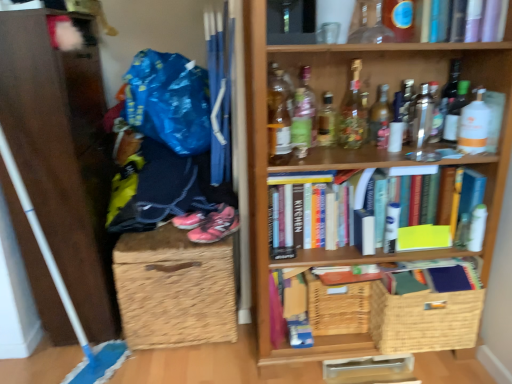
At what (x,y) coordinates should I click in order to perform the action: click on woven straw basket at lower center. Please return your answer as a coordinate pair (x, y). Looking at the image, I should click on (174, 289).

This screenshot has width=512, height=384. What do you see at coordinates (174, 289) in the screenshot?
I see `woven straw basket at lower center` at bounding box center [174, 289].

What do you see at coordinates (62, 154) in the screenshot? Image resolution: width=512 pixels, height=384 pixels. I see `brown wicker basket at lower left` at bounding box center [62, 154].

Where is `woven brown basket at lower right, the first basket from the right`? The width and height of the screenshot is (512, 384). woven brown basket at lower right, the first basket from the right is located at coordinates (424, 320).

From the picture: Considering the relative sizes of translucent glass bottle at center, the eighth bottle positioned from the right, and translucent plastic bottle at upper right, which is the eleventh bottle from left to right, in the image provided, is translucent glass bottle at center, the eighth bottle positioned from the right, thinner than translucent plastic bottle at upper right, which is the eleventh bottle from left to right,?

No, translucent glass bottle at center, the eighth bottle positioned from the right, is not thinner than translucent plastic bottle at upper right, which is the eleventh bottle from left to right.

Based on the photo, between translucent glass bottle at center, which is the fourth bottle from left to right, and translucent plastic bottle at upper right, which is the eleventh bottle from left to right, which one is positioned behind?

translucent glass bottle at center, which is the fourth bottle from left to right, is further away from the camera.

From a real-world perspective, who is located lower, translucent glass bottle at center, the eighth bottle positioned from the right, or translucent plastic bottle at upper right, which is the eleventh bottle from left to right?

From a 3D spatial view, translucent glass bottle at center, the eighth bottle positioned from the right, is below.

Is translucent glass bottle at center, which is the fourth bottle from left to right, inside or outside of translucent plastic bottle at upper right, positioned as the 1th bottle in right-to-left order?

translucent glass bottle at center, which is the fourth bottle from left to right, is spatially situated outside translucent plastic bottle at upper right, positioned as the 1th bottle in right-to-left order.

Is translucent glass bottle at upper center, marked as the eleventh bottle in a right-to-left arrangement, looking in the opposite direction of woven brown basket at lower right, the second basket when ordered from left to right?

No.

Can you confirm if translucent glass bottle at upper center, the first bottle from the left, is positioned to the left of woven brown basket at lower right, the second basket when ordered from left to right?

Yes, translucent glass bottle at upper center, the first bottle from the left, is to the left of woven brown basket at lower right, the second basket when ordered from left to right.

Is translucent glass bottle at upper center, the first bottle from the left, in front of or behind woven brown basket at lower right, the first basket from the right, in the image?

translucent glass bottle at upper center, the first bottle from the left, is in front of woven brown basket at lower right, the first basket from the right.

Is translucent glass bottle at upper center, the first bottle from the left, situated inside woven brown basket at lower right, the second basket when ordered from left to right, or outside?

translucent glass bottle at upper center, the first bottle from the left, is outside woven brown basket at lower right, the second basket when ordered from left to right.

Is woven straw basket at lower center not inside green glass bottle at upper center, the second bottle from the left?

Absolutely, woven straw basket at lower center is external to green glass bottle at upper center, the second bottle from the left.

Can you confirm if woven straw basket at lower center is bigger than green glass bottle at upper center, the second bottle from the left?

Correct, woven straw basket at lower center is larger in size than green glass bottle at upper center, the second bottle from the left.

Which object is positioned more to the left, woven straw basket at lower center or green glass bottle at upper center, the second bottle from the left?

A: woven straw basket at lower center.

Is green glass bottle at upper center, the 10th bottle from the right, at the back of woven straw basket at lower center?

No, woven straw basket at lower center is not facing the opposite direction of green glass bottle at upper center, the 10th bottle from the right.

Based on the photo, could wooden bookcase at upper right be considered to be inside woven straw basket at lower center?

No, wooden bookcase at upper right is not surrounded by woven straw basket at lower center.

Is woven straw basket at lower center facing away from wooden bookcase at upper right?

No, woven straw basket at lower center's orientation is not away from wooden bookcase at upper right.

I want to click on storage box directly beneath the wooden bookcase at upper right (from a real-world perspective), so click(174, 289).

Considering the relative sizes of green glass bottle at upper center, acting as the third bottle starting from the left, and translucent plastic bottle at upper right, which is the eleventh bottle from left to right, in the image provided, is green glass bottle at upper center, acting as the third bottle starting from the left, thinner than translucent plastic bottle at upper right, which is the eleventh bottle from left to right,?

Yes.

This screenshot has width=512, height=384. I want to click on bottle that is the 6th one when counting backward from the translucent plastic bottle at upper right, positioned as the 1th bottle in right-to-left order, so click(306, 103).

From the image's perspective, is green glass bottle at upper center, acting as the third bottle starting from the left, over translucent plastic bottle at upper right, which is the eleventh bottle from left to right?

Yes, from the image's perspective, green glass bottle at upper center, acting as the third bottle starting from the left, is above translucent plastic bottle at upper right, which is the eleventh bottle from left to right.

Would you say green glass bottle at upper center, acting as the third bottle starting from the left, is inside or outside translucent plastic bottle at upper right, positioned as the 1th bottle in right-to-left order?

green glass bottle at upper center, acting as the third bottle starting from the left, is spatially situated outside translucent plastic bottle at upper right, positioned as the 1th bottle in right-to-left order.

From the image's perspective, is wooden bookcase at upper right over translucent glass bottle at upper center, the first bottle from the left?

No.

What are the coordinates of `the 5th bottle counting from the left of the wooden bookcase at upper right` in the screenshot? It's located at (278, 118).

Can you confirm if wooden bookcase at upper right is bigger than translucent glass bottle at upper center, marked as the eleventh bottle in a right-to-left arrangement?

Yes, wooden bookcase at upper right is bigger than translucent glass bottle at upper center, marked as the eleventh bottle in a right-to-left arrangement.

Which point is more distant from viewer, (x=390, y=251) or (x=460, y=82)?

The point (x=390, y=251) is farther.

From the image's perspective, is hardcover books at center, acting as the second book starting from the top, located above clear glass bottle at upper right, which appears as the 10th bottle when viewed from the left?

No, from the image's perspective, hardcover books at center, acting as the second book starting from the top, is not on top of clear glass bottle at upper right, which appears as the 10th bottle when viewed from the left.

I want to click on bottle that is the 4th object above the translucent glass bottle at center, the eighth bottle positioned from the right (from a real-world perspective), so click(474, 125).

Identify the location of the 1st bottle positioned above the woven brown basket at lower right, the first basket from the right (from the image's perspective). This screenshot has height=384, width=512. (278, 118).

Consider the image. From the image, which object appears to be farther from clear glass bottle at upper center, placed as the 3th bottle when sorted from right to left, translucent glass bottle at center, which is the fourth bottle from left to right, or matte yellow notebook at lower right, acting as the third book starting from the top?

Among the two, matte yellow notebook at lower right, acting as the third book starting from the top, is located further to clear glass bottle at upper center, placed as the 3th bottle when sorted from right to left.

From the image, which object appears to be nearer to translucent glass bottle at upper center, placed as the eighth bottle when sorted from left to right, hardcover books at center, the 3th book positioned from the bottom, or cardboard box at center, the first book ordered from the bottom?

Based on the image, hardcover books at center, the 3th book positioned from the bottom, appears to be nearer to translucent glass bottle at upper center, placed as the eighth bottle when sorted from left to right.

Looking at the image, which one is located further to wooden bookcase at upper right, translucent plastic bottle at upper right, which is the eleventh bottle from left to right, or cardboard box at center, the first book ordered from the bottom?

Based on the image, translucent plastic bottle at upper right, which is the eleventh bottle from left to right, appears to be further to wooden bookcase at upper right.

Looking at the image, which one is located further to translucent plastic bottle at upper right, which is the eleventh bottle from left to right, green glass bottle at upper center, acting as the third bottle starting from the left, or hardcover book at upper center, which is counted as the 4th book, starting from the bottom?

The object further to translucent plastic bottle at upper right, which is the eleventh bottle from left to right, is green glass bottle at upper center, acting as the third bottle starting from the left.

Estimate the real-world distances between objects in this image. Which object is closer to green glass bottle at upper center, the 10th bottle from the right, woven brown basket at lower right, the first basket from the right, or translucent glass bottle at upper center, the fourth bottle viewed from the right?

Among the two, translucent glass bottle at upper center, the fourth bottle viewed from the right, is located nearer to green glass bottle at upper center, the 10th bottle from the right.

Which object lies nearer to the anchor point hardcover book at upper center, the 1th book in the top-to-bottom sequence, translucent glass bottle at upper center, the first bottle from the left, or clear glass bottle at upper right, positioned as the second bottle in right-to-left order?

The object closer to hardcover book at upper center, the 1th book in the top-to-bottom sequence, is clear glass bottle at upper right, positioned as the second bottle in right-to-left order.

Based on their spatial positions, is matte yellow notebook at lower right, positioned as the second book in bottom-to-top order, or woven wood basket at lower center, the second basket in the right-to-left sequence, further from wooden bookcase at upper right?

matte yellow notebook at lower right, positioned as the second book in bottom-to-top order, is positioned further to the anchor wooden bookcase at upper right.

Considering their positions, is translucent glass bottle at center, the eighth bottle positioned from the right, positioned closer to wooden bookcase at upper right than brown wicker basket at lower left?

The object closer to wooden bookcase at upper right is translucent glass bottle at center, the eighth bottle positioned from the right.

The image size is (512, 384). In order to click on footwear between brown wicker basket at lower left and woven wood basket at lower center, the 1th basket positioned from the left, in the horizontal direction in this screenshot , I will do `click(215, 226)`.

Find the location of a particular element. The width and height of the screenshot is (512, 384). bookcase between hardcover book at upper center, which is counted as the 4th book, starting from the bottom, and matte yellow notebook at lower right, acting as the third book starting from the top, from top to bottom is located at coordinates (362, 168).

Identify the location of basket between wooden bookcase at upper right and woven wood basket at lower center, the second basket in the right-to-left sequence, in the vertical direction. The width and height of the screenshot is (512, 384). (424, 320).

I want to click on bookcase that lies between translucent glass bottle at center, acting as the 5th bottle starting from the left, and hardcover books at center, the 3th book positioned from the bottom, from top to bottom, so click(x=362, y=168).